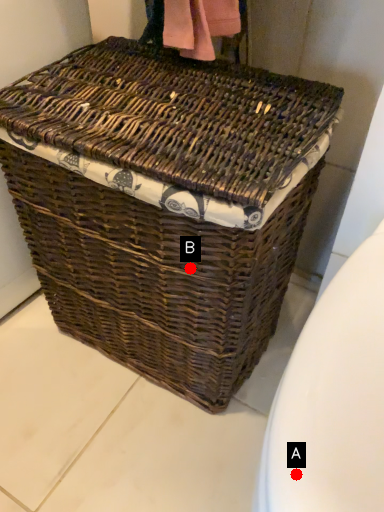
Question: Two points are circled on the image, labeled by A and B beside each circle. Which point is farther to the camera?

Choices:
 (A) A is further
 (B) B is further

Answer: (B)